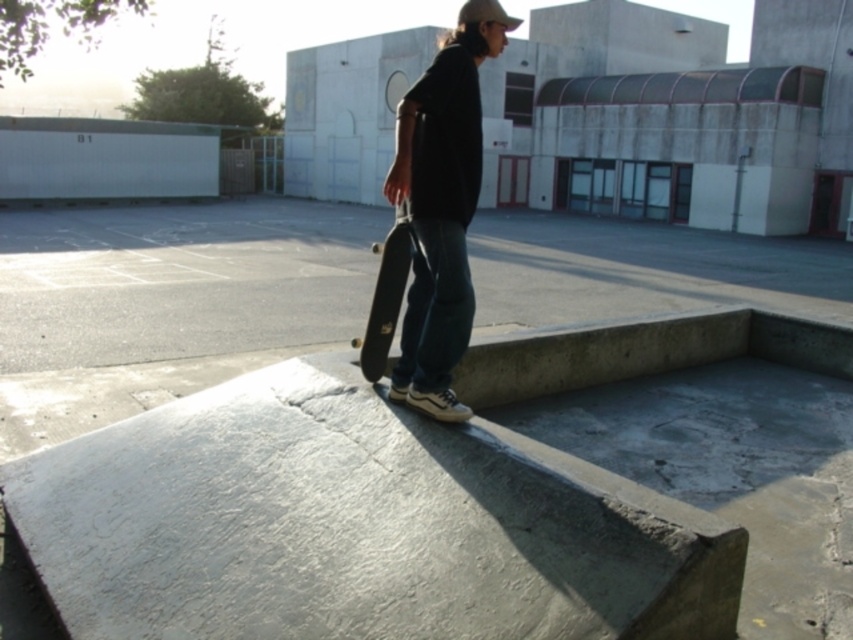
You are a photographer trying to capture both the matte black skateboard at center and the black smooth skateboard at center in a single shot. Since they are positioned differently, which skateboard will appear larger in the photo?

The matte black skateboard at center will appear larger in the photo because it is closer to the viewer than the black smooth skateboard at center.

You are a photographer setting up for a shoot and need to position two skateboards on a table. The matte black skateboard at center and the black smooth skateboard at center must be placed such that the taller one is in front. Which skateboard should you place in front?

The matte black skateboard at center is taller than the black smooth skateboard at center, so you should place the matte black skateboard at center in front to ensure it is visible.